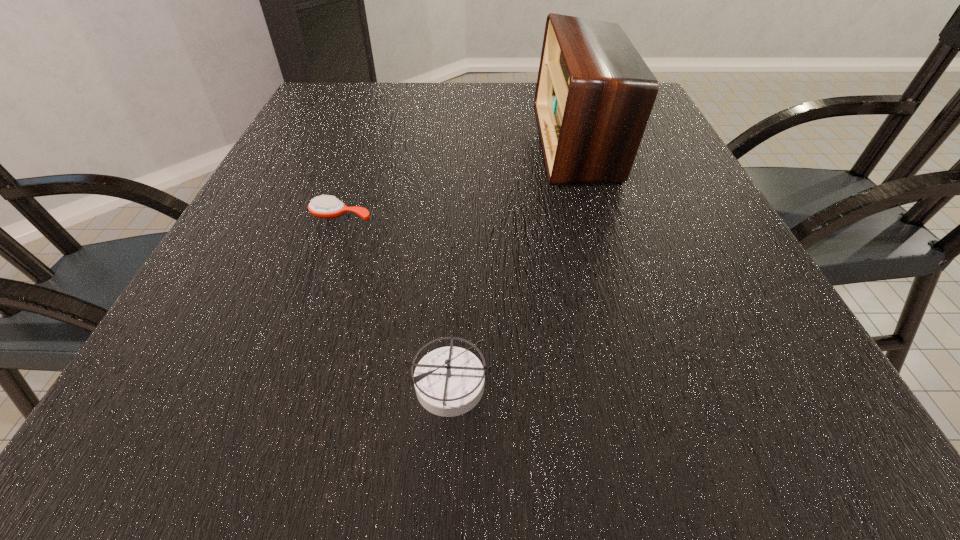
Find the location of a particular element. The image size is (960, 540). radio receiver is located at coordinates (594, 95).

Where is `the farthest object`? Image resolution: width=960 pixels, height=540 pixels. the farthest object is located at coordinates (594, 95).

Identify the location of compass. The width and height of the screenshot is (960, 540). (449, 381).

Locate an element on the screen. the nearest object is located at coordinates (449, 381).

Locate an element on the screen. The height and width of the screenshot is (540, 960). the leftmost object is located at coordinates (327, 207).

You are a GUI agent. You are given a task and a screenshot of the screen. Output one action in this format:
    pyautogui.click(x=<x>, y=<y>)
    Task: Click on the shortest object
    
    Given the screenshot: What is the action you would take?
    pyautogui.click(x=327, y=207)

This screenshot has width=960, height=540. Find the location of `vacant space located on the front-facing side of the radio receiver`. vacant space located on the front-facing side of the radio receiver is located at coordinates (412, 143).

The width and height of the screenshot is (960, 540). What are the coordinates of `vacant space located on the front-facing side of the radio receiver` in the screenshot? It's located at (396, 143).

Find the location of `free space located on the front-facing side of the radio receiver`. free space located on the front-facing side of the radio receiver is located at coordinates (480, 143).

At what (x,y) coordinates should I click in order to perform the action: click on vacant area situated 0.150m on the right of the compass. Please return your answer as a coordinate pair (x, y). The image size is (960, 540). Looking at the image, I should click on [602, 382].